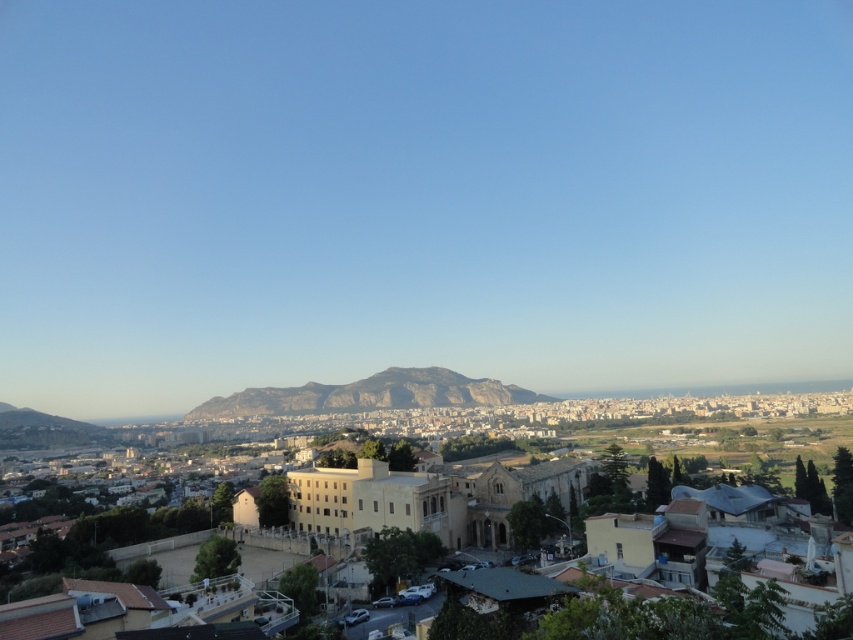
You are an architect analyzing the cityscape. You notice the beige stone church at center and the rugged brown rock at center. Which object is positioned higher in the image?

The beige stone church at center is positioned higher than the rugged brown rock at center in the image.

You are a drone operator trying to navigate between two points in the city. You see the point at coordinates point (781,403) and the point at coordinates point (509,397). Which point is farther away from you, the observer?

Point (781,403) is behind point (509,397), so it is farther away from you.

You are a city planner assessing the distance between the beige stone church at center and the rugged brown rock at center for a new pedestrian path. Given that the path requires a minimum of 100 meters between landmarks for safety, will the proposed path between these two landmarks meet the requirement?

The beige stone church at center is 119.20 meters from the rugged brown rock at center, which exceeds the 100 meters requirement, so the proposed path between these two landmarks will meet the safety requirement.